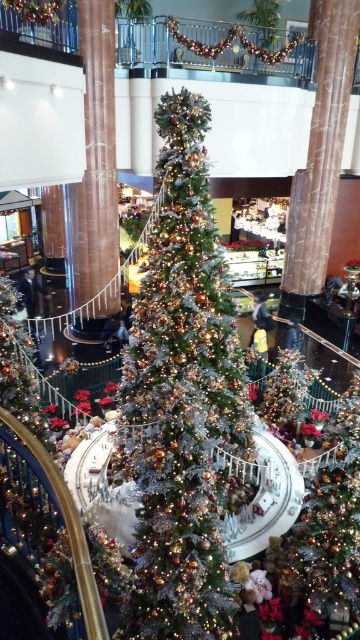
You are a visitor at the mall and want to take a photo of the shiny silver christmas tree at center without the brown marble pillar at center blocking the view. Is there a position where you can stand to achieve this?

The shiny silver christmas tree at center is located below the brown marble pillar at center, so if you stand to the side of the pillar, you can position yourself where the pillar is not in front of the tree, allowing you to take a clear photo of the shiny silver christmas tree at center without obstruction.

Consider the image. You are standing at the entrance of the mall and see the festive scene described. There is a shiny silver christmas tree at center located at point (182, 400). If you want to take a photo of the tree without any obstructions, which direction should you move to ensure the tree is fully visible?

To ensure the shiny silver christmas tree at center is fully visible without obstructions, you should move to a position where the tree is centered in your view. Since the tree is located at point (182, 400), moving directly towards that point or adjusting your angle to face it squarely would provide an unobstructed view.

You are a delivery person who needs to place a large box in the space between the shiny silver christmas tree at center and the brown marble pillar at center. Can you fit the box there?

The shiny silver christmas tree at center might be wider than brown marble pillar at center, so there might not be enough space to fit the large box between them.